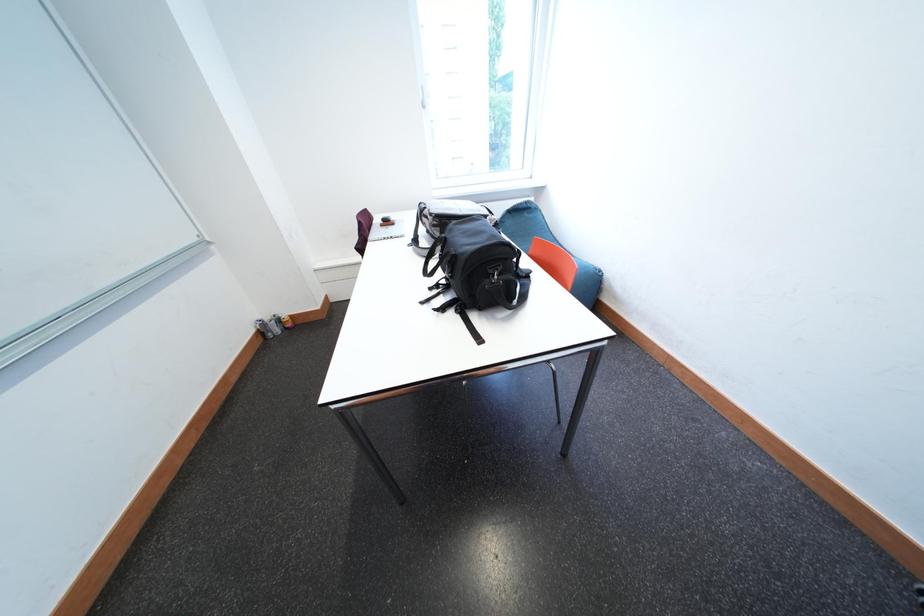
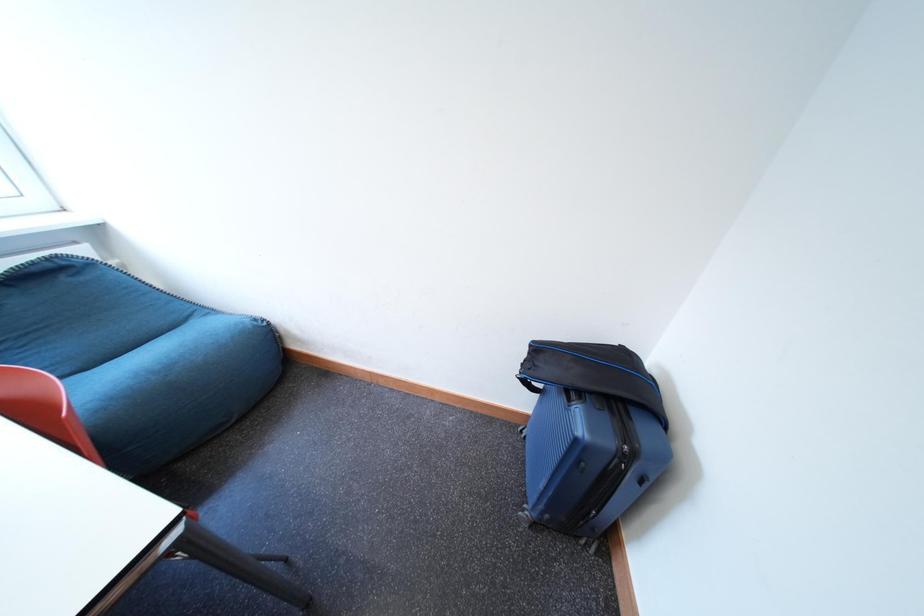
Question: The camera is either moving clockwise (left) or counter-clockwise (right) around the object. The first image is from the beginning of the video and the second image is from the end. Is the camera moving left or right when shooting the video?

Choices:
 (A) Left
 (B) Right

Answer: (A)